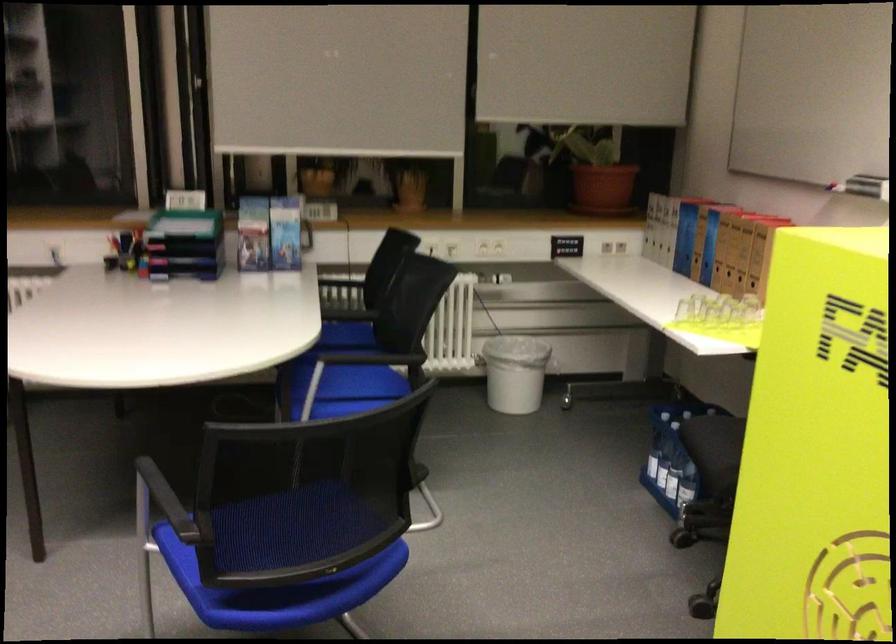
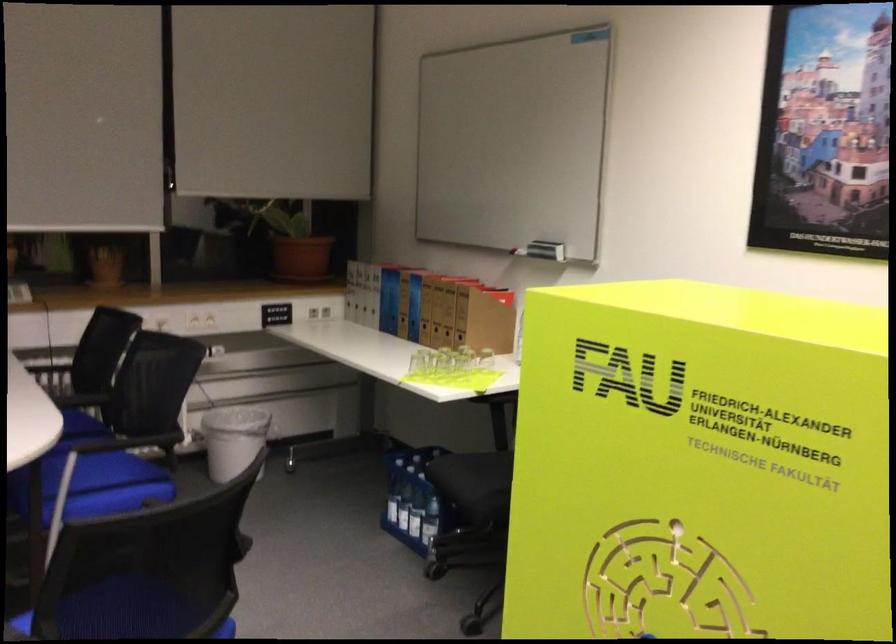
In the second image, find the point that corresponds to (x=675, y=258) in the first image.

(382, 321)